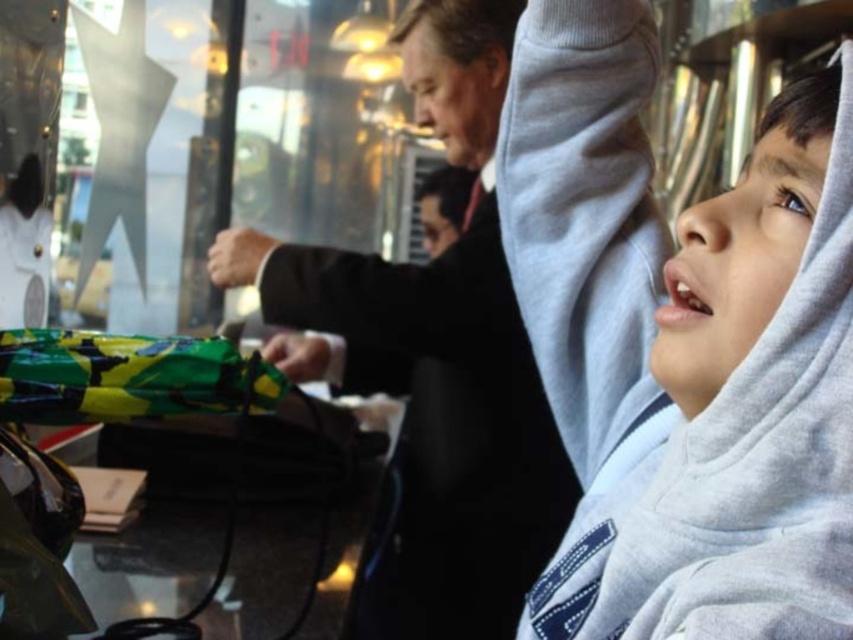
Who is lower down, gray fleece hoodie at upper right or black matte suit at center?

gray fleece hoodie at upper right

Does gray fleece hoodie at upper right lie in front of black matte suit at center?

Yes, gray fleece hoodie at upper right is in front of black matte suit at center.

Is point (682, 538) farther from viewer compared to point (221, 248)?

No.

In order to click on gray fleece hoodie at upper right in this screenshot , I will do `click(651, 376)`.